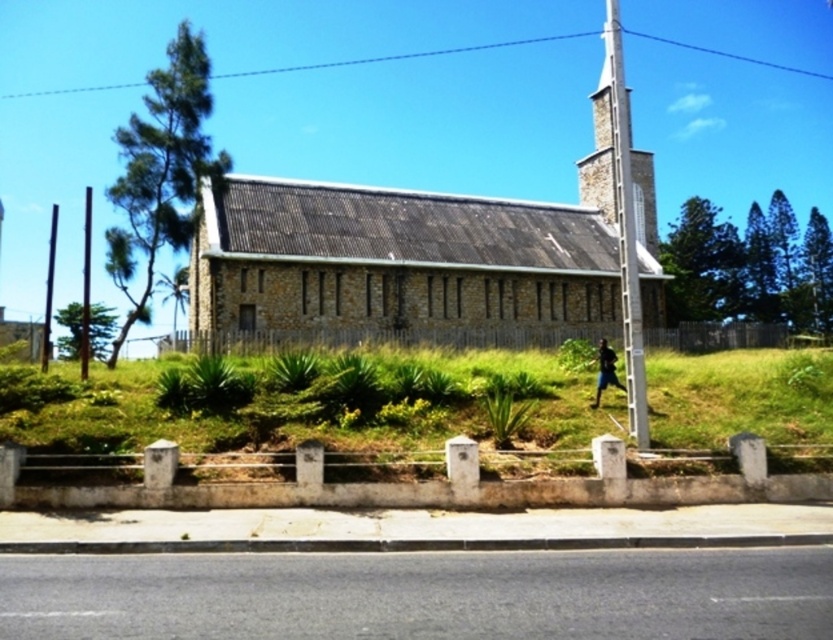
The width and height of the screenshot is (833, 640). Describe the element at coordinates (425, 259) in the screenshot. I see `brown stone church at center` at that location.

This screenshot has width=833, height=640. I want to click on brown stone church at center, so click(425, 259).

Can you confirm if gray concrete curb at lower center is positioned below stone steeple at upper center?

Correct, gray concrete curb at lower center is located below stone steeple at upper center.

Who is positioned more to the left, gray concrete curb at lower center or stone steeple at upper center?

From the viewer's perspective, gray concrete curb at lower center appears more on the left side.

Locate an element on the screen. This screenshot has width=833, height=640. gray concrete curb at lower center is located at coordinates (439, 493).

Can you confirm if gray concrete curb at lower center is taller than dark blue fabric at right?

Incorrect, gray concrete curb at lower center's height is not larger of dark blue fabric at right's.

Which is behind, point (691, 493) or point (591, 404)?

The point (591, 404) is behind.

Find the location of a particular element. The image size is (833, 640). gray concrete curb at lower center is located at coordinates 439,493.